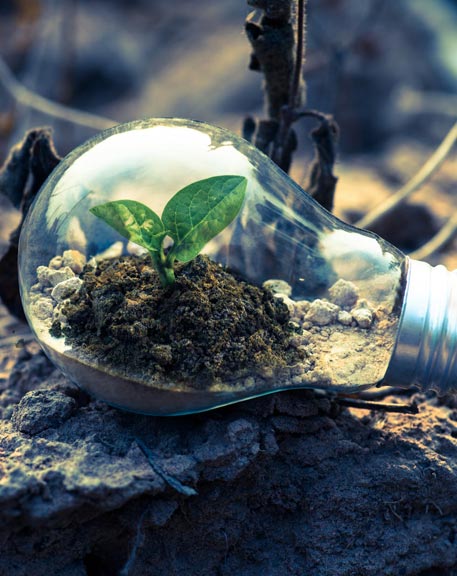
Image resolution: width=457 pixels, height=576 pixels. What are the coordinates of `metal part of lightbulb` in the screenshot? It's located at (431, 321).